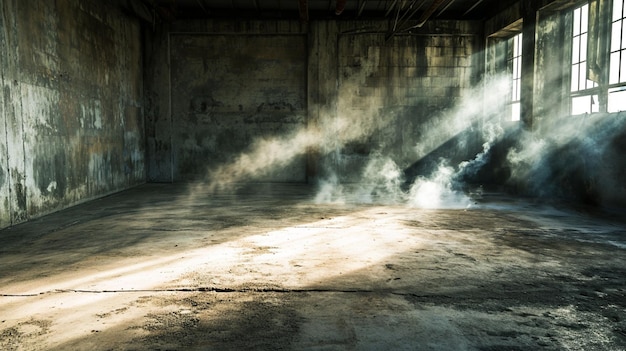
The height and width of the screenshot is (351, 626). Identify the location of corner. (143, 97).